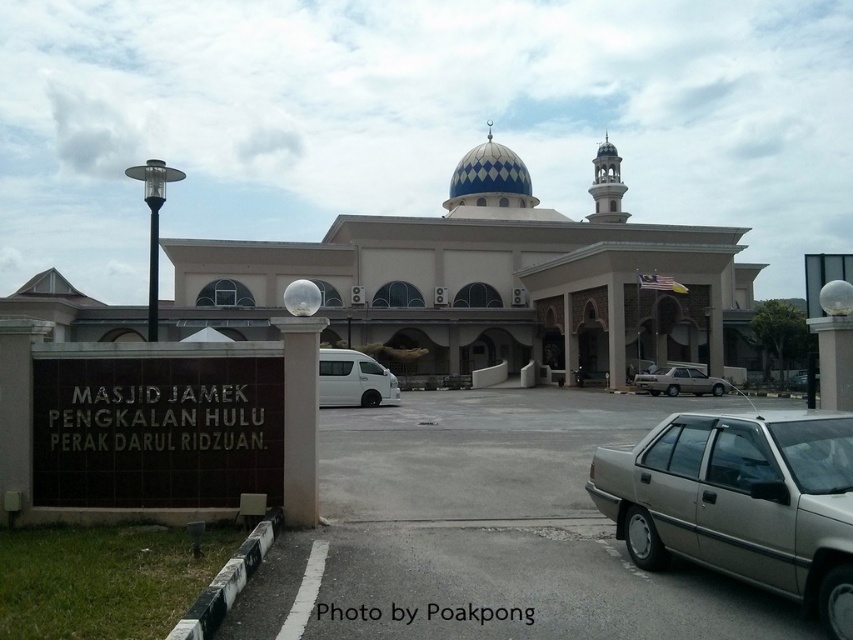
You are standing at the entrance of the mosque and want to take a photo of both the point at coordinates point (479, 148) and point (675, 378). Which point should you focus on first to ensure both are in focus?

You should focus on point (479, 148) first because it is closer to the camera than point (675, 378). This way, both points will be within the depth of field.

You are standing at the entrance of Masjid Jamek Pengkalan Hulu Perak Darul Ridzuan. You want to walk to the point marked at coordinates [490,531]. Based on the scene description, where exactly is this point located?

The point marked at coordinates [490,531] is located on the gray asphalt parking lot at center.